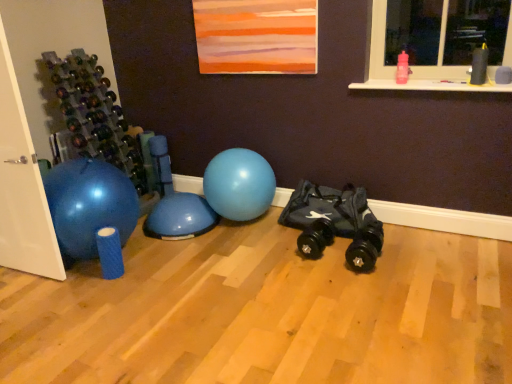
Question: Is pink plastic water bottle at upper right closer to the viewer compared to black rubber toy car at center?

Choices:
 (A) no
 (B) yes

Answer: (B)

Question: Is pink plastic water bottle at upper right outside black rubber toy car at center?

Choices:
 (A) yes
 (B) no

Answer: (A)

Question: Would you say pink plastic water bottle at upper right contains black rubber toy car at center?

Choices:
 (A) no
 (B) yes

Answer: (A)

Question: Does pink plastic water bottle at upper right have a lesser width compared to black rubber toy car at center?

Choices:
 (A) yes
 (B) no

Answer: (A)

Question: Considering the relative sizes of pink plastic water bottle at upper right and black rubber toy car at center in the image provided, is pink plastic water bottle at upper right smaller than black rubber toy car at center?

Choices:
 (A) yes
 (B) no

Answer: (A)

Question: In terms of width, does blue rubber ball at center look wider or thinner when compared to black rubber toy car at center?

Choices:
 (A) thin
 (B) wide

Answer: (B)

Question: In terms of height, does blue rubber ball at center look taller or shorter compared to black rubber toy car at center?

Choices:
 (A) short
 (B) tall

Answer: (B)

Question: From the image's perspective, is blue rubber ball at center located above or below black rubber toy car at center?

Choices:
 (A) below
 (B) above

Answer: (B)

Question: From a real-world perspective, relative to black rubber toy car at center, is blue rubber ball at center vertically above or below?

Choices:
 (A) below
 (B) above

Answer: (B)

Question: From a real-world perspective, relative to blue rubber ball at center, is pink plastic water bottle at upper right vertically above or below?

Choices:
 (A) below
 (B) above

Answer: (B)

Question: In terms of size, does pink plastic water bottle at upper right appear bigger or smaller than blue rubber ball at center?

Choices:
 (A) big
 (B) small

Answer: (B)

Question: From the image's perspective, is pink plastic water bottle at upper right positioned above or below blue rubber ball at center?

Choices:
 (A) above
 (B) below

Answer: (A)

Question: Is pink plastic water bottle at upper right taller or shorter than blue rubber ball at center?

Choices:
 (A) tall
 (B) short

Answer: (B)

Question: Is point (366, 231) positioned closer to the camera than point (259, 193)?

Choices:
 (A) farther
 (B) closer

Answer: (B)

Question: Is black rubber toy car at center wider or thinner than blue rubber ball at center?

Choices:
 (A) wide
 (B) thin

Answer: (B)